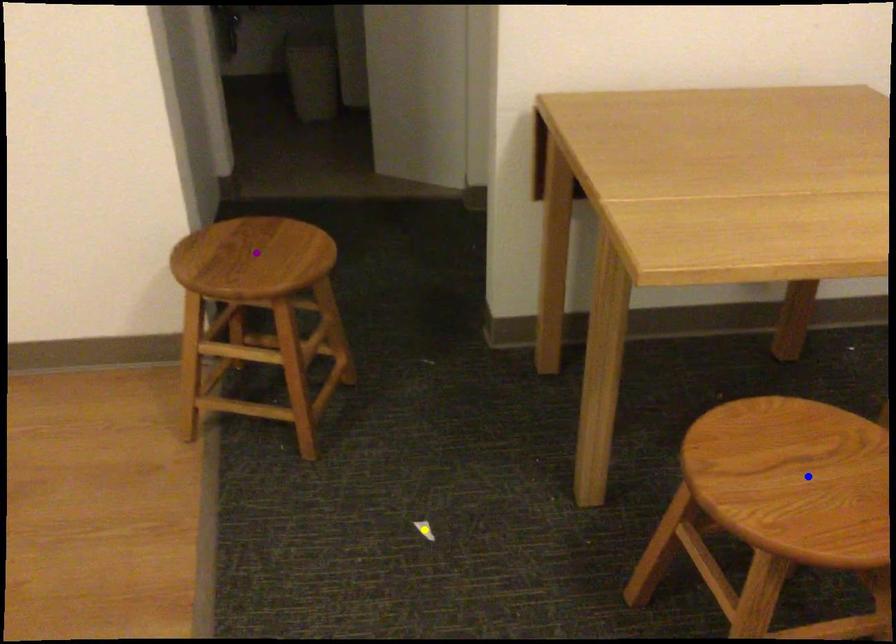
Order these from farthest to nearest:
yellow point
blue point
purple point

1. purple point
2. yellow point
3. blue point